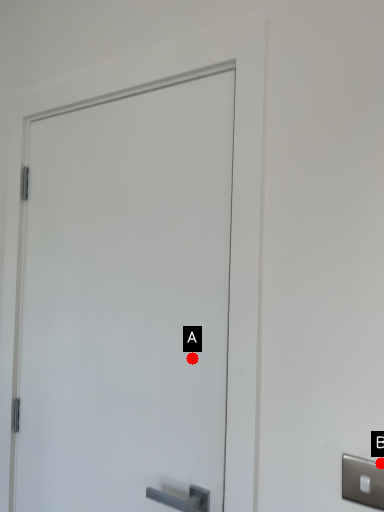
Question: Two points are circled on the image, labeled by A and B beside each circle. Among these points, which one is nearest to the camera?

Choices:
 (A) A is closer
 (B) B is closer

Answer: (B)